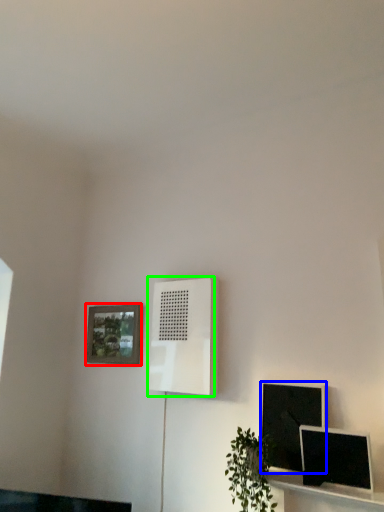
Question: Considering the real-world distances, which object is closest to picture frame (highlighted by a red box)? computer monitor (highlighted by a blue box) or air conditioner (highlighted by a green box).

Choices:
 (A) computer monitor
 (B) air conditioner

Answer: (B)